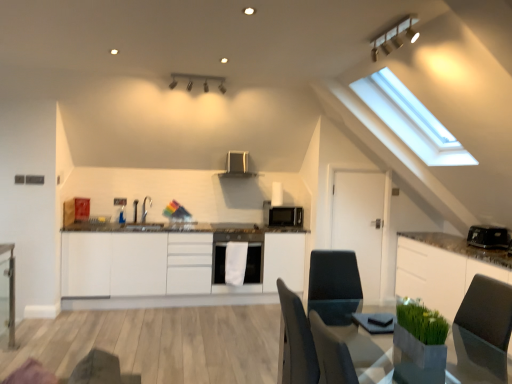
Find the location of `blank space above matte silver light fixture at upper center, the 2th light fixture when ordered from left to right (from a real-world perspective)`. blank space above matte silver light fixture at upper center, the 2th light fixture when ordered from left to right (from a real-world perspective) is located at coordinates tap(391, 24).